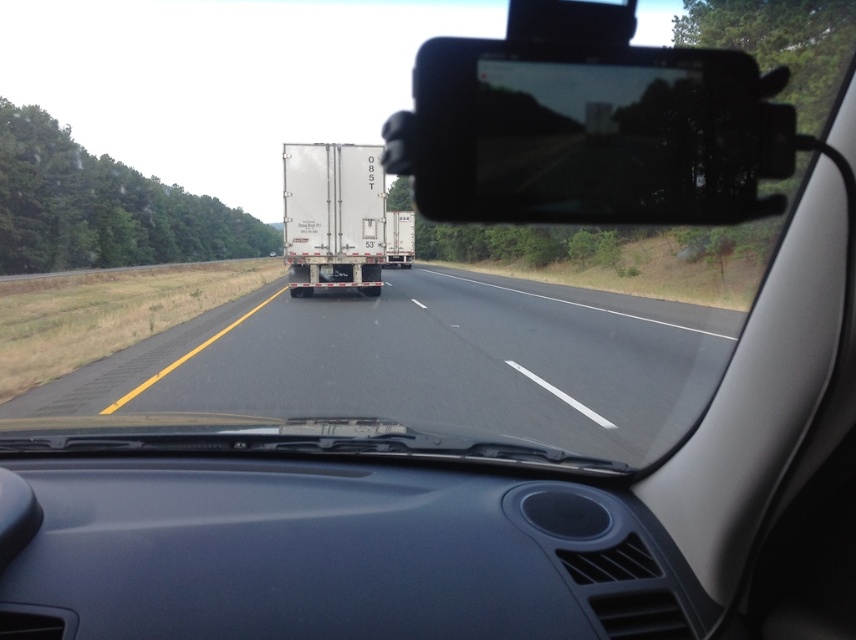
Question: Is gray asphalt highway at center smaller than white matte trailer truck at center?

Choices:
 (A) no
 (B) yes

Answer: (A)

Question: Considering the relative positions of black plastic view mirror at upper center and white matte trailer at center in the image provided, where is black plastic view mirror at upper center located with respect to white matte trailer at center?

Choices:
 (A) below
 (B) above

Answer: (B)

Question: Which of the following is the farthest from the observer?

Choices:
 (A) white matte trailer at center
 (B) gray asphalt highway at center

Answer: (A)

Question: Can you confirm if matte black dashboard at center is bigger than white matte trailer truck at center?

Choices:
 (A) no
 (B) yes

Answer: (A)

Question: Which point appears closest to the camera in this image?

Choices:
 (A) (x=49, y=467)
 (B) (x=504, y=364)
 (C) (x=391, y=257)

Answer: (A)

Question: Which object is positioned closest to the black plastic view mirror at upper center?

Choices:
 (A) matte black dashboard at center
 (B) gray asphalt highway at center

Answer: (B)